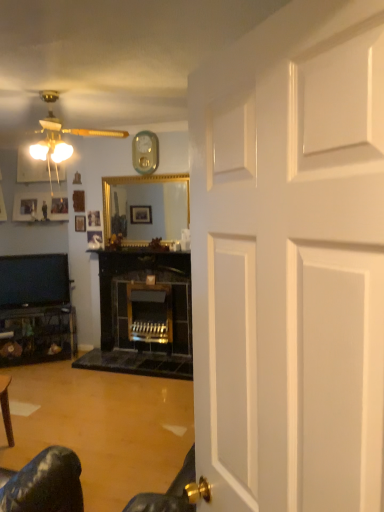
Where is `vacant area situated below gold-framed mirror at center (from a real-world perspective)`? vacant area situated below gold-framed mirror at center (from a real-world perspective) is located at coordinates (147, 249).